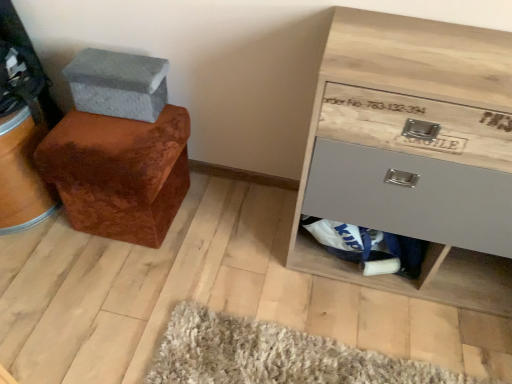
The height and width of the screenshot is (384, 512). In order to click on vacant area that is in front of wooden chest of drawers at lower right in this screenshot , I will do `click(420, 325)`.